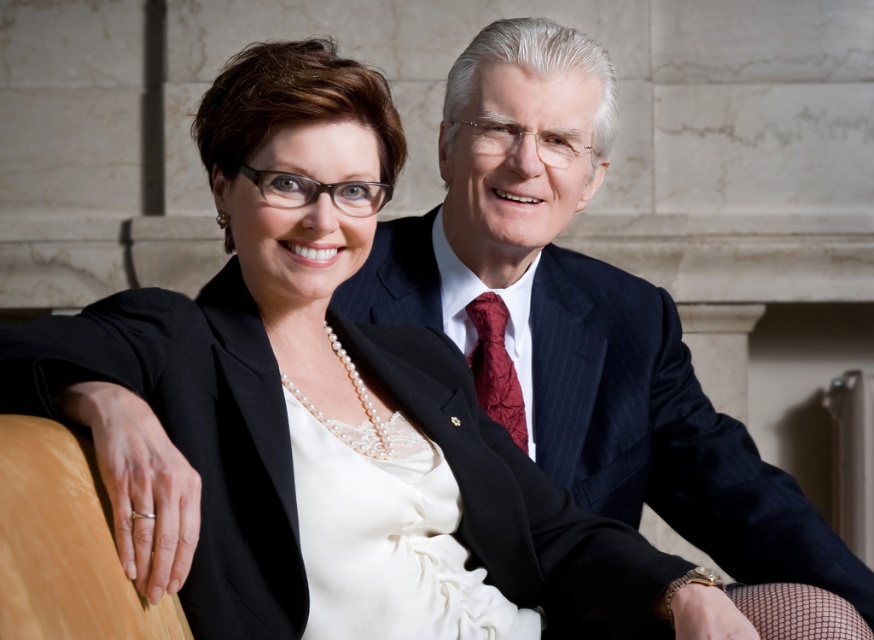
Does dark blue pinstripe suit at upper right have a smaller size compared to shiny burgundy silk tie at center?

Actually, dark blue pinstripe suit at upper right might be larger than shiny burgundy silk tie at center.

Is point (801, 499) positioned after point (497, 380)?

No, it is in front of (497, 380).

The height and width of the screenshot is (640, 874). In order to click on dark blue pinstripe suit at upper right in this screenshot , I will do `click(662, 433)`.

Which is more to the left, white satin dress at center or shiny burgundy silk tie at center?

Positioned to the left is white satin dress at center.

Does white satin dress at center have a larger size compared to shiny burgundy silk tie at center?

Yes.

Does point (325, 616) come in front of point (486, 374)?

Yes, it is.

Locate an element on the screen. white satin dress at center is located at coordinates (387, 541).

Consider the image. Is dark blue pinstripe suit at upper right smaller than white satin dress at center?

Actually, dark blue pinstripe suit at upper right might be larger than white satin dress at center.

Is dark blue pinstripe suit at upper right positioned behind white satin dress at center?

Yes, it is behind white satin dress at center.

What do you see at coordinates (662, 433) in the screenshot? Image resolution: width=874 pixels, height=640 pixels. I see `dark blue pinstripe suit at upper right` at bounding box center [662, 433].

Locate an element on the screen. dark blue pinstripe suit at upper right is located at coordinates (662, 433).